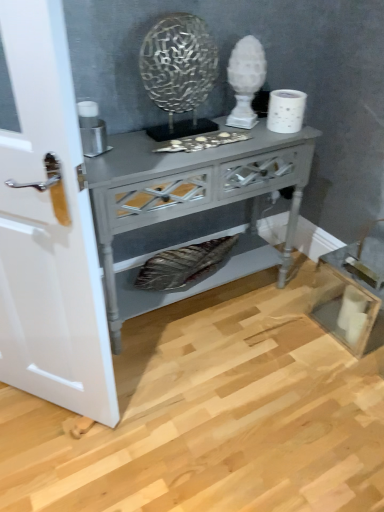
Where is `vacant point to the right of metallic silver candle holder at left`? The height and width of the screenshot is (512, 384). vacant point to the right of metallic silver candle holder at left is located at coordinates (133, 152).